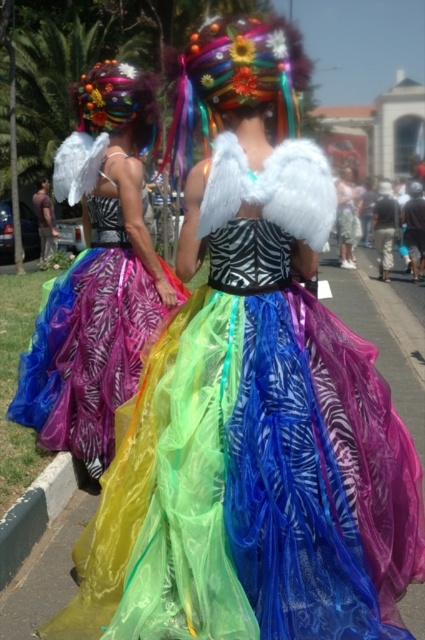
Who is positioned more to the left, rainbow tulle dress at center or green rubber curb at lower left?

Positioned to the left is green rubber curb at lower left.

Does rainbow tulle dress at center have a greater height compared to green rubber curb at lower left?

Indeed, rainbow tulle dress at center has a greater height compared to green rubber curb at lower left.

Where is `rainbow tulle dress at center`? rainbow tulle dress at center is located at coordinates (255, 449).

Is the position of rainbow tulle dress at center less distant than that of shiny multicolored dress at center?

Yes, rainbow tulle dress at center is closer to the viewer.

Can you confirm if rainbow tulle dress at center is smaller than shiny multicolored dress at center?

Yes, rainbow tulle dress at center is smaller than shiny multicolored dress at center.

Who is more forward, (331, 564) or (121, 282)?

Positioned in front is point (331, 564).

This screenshot has width=425, height=640. Find the location of `rainbow tulle dress at center`. rainbow tulle dress at center is located at coordinates (255, 449).

Which is behind, point (93, 232) or point (359, 193)?

The point (359, 193) is more distant.

Can you confirm if shiny multicolored dress at center is thinner than matte white wings at center?

Incorrect, shiny multicolored dress at center's width is not less than matte white wings at center's.

I want to click on shiny multicolored dress at center, so click(99, 275).